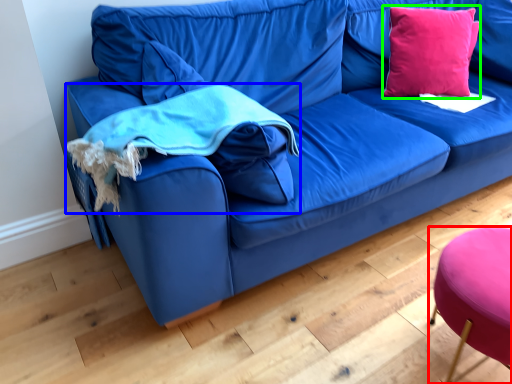
Question: Based on their relative distances, which object is farther from stool (highlighted by a red box)? Choose from cloth (highlighted by a blue box) and throw pillow (highlighted by a green box).

Choices:
 (A) cloth
 (B) throw pillow

Answer: (B)